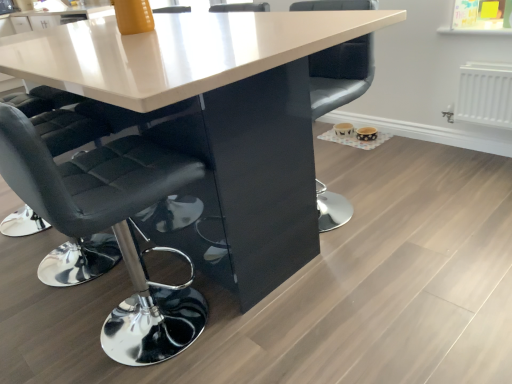
The image size is (512, 384). Identify the location of vacant area located to the right-hand side of black leather chair at left, acting as the second chair starting from the right. (264, 326).